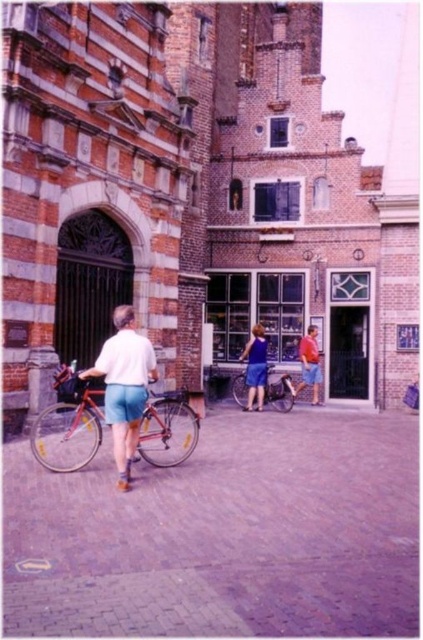
Which is more to the right, white cotton shirt at center or shiny metallic bicycle at center?

From the viewer's perspective, shiny metallic bicycle at center appears more on the right side.

In the scene shown: Measure the distance between white cotton shirt at center and camera.

A distance of 31.47 meters exists between white cotton shirt at center and camera.

Is point (128, 305) farther from viewer compared to point (282, 372)?

No, (128, 305) is closer to viewer.

At what (x,y) coordinates should I click in order to perform the action: click on white cotton shirt at center. Please return your answer as a coordinate pair (x, y). Looking at the image, I should click on (125, 385).

Measure the distance from white cotton shirt at center to orange fabric shirt at center.

The distance of white cotton shirt at center from orange fabric shirt at center is 23.39 meters.

Is white cotton shirt at center to the right of orange fabric shirt at center from the viewer's perspective?

In fact, white cotton shirt at center is to the left of orange fabric shirt at center.

Between point (132, 422) and point (313, 362), which one is positioned behind?

Positioned behind is point (313, 362).

The height and width of the screenshot is (640, 423). I want to click on white cotton shirt at center, so click(x=125, y=385).

Who is lower down, shiny metallic bicycle at left or orange fabric shirt at center?

shiny metallic bicycle at left is lower down.

Who is more distant from viewer, (147, 458) or (318, 385)?

The point (318, 385) is more distant.

Between point (32, 451) and point (313, 348), which one is positioned in front?

Point (32, 451) is more forward.

Identify the location of shiny metallic bicycle at left. The height and width of the screenshot is (640, 423). (68, 424).